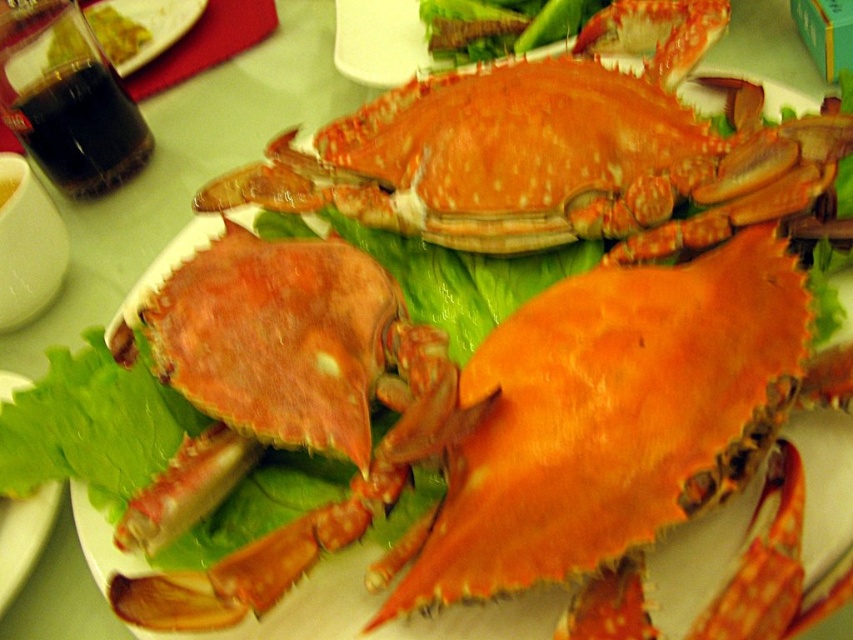
From the picture: You are a food critic standing 20 inches away from a plate of cooked crabs. You notice the orange matte crab at center. Can you reach out and touch it without moving your position?

The orange matte crab at center is 19.33 inches away from viewer, so yes, you can reach out and touch it without moving your position since it is within your 20 inches range.

You are a food critic inspecting this crab dish. You need to describe the arrangement of the orange matte crab at center and the green leafy lettuce at lower left. Which one is positioned to the right side?

The orange matte crab at center is positioned to the right of the green leafy lettuce at lower left.

Based on the photo, you are a food critic evaluating this crab dish. You need to describe the height comparison between the orange matte crab at center and the green leafy lettuce at lower left. Which one is taller?

The orange matte crab at center is much taller than the green leafy lettuce at lower left according to the description.